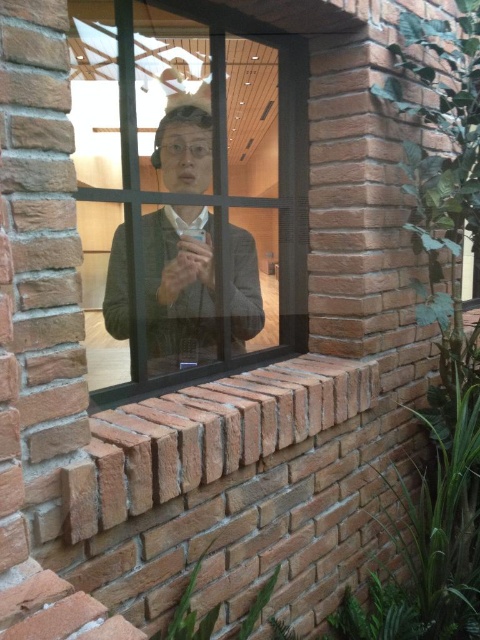
You are standing outside the brick wall and want to see the person inside holding the phone. Which direction should you look relative to the point marked at coordinates [190,188]?

You should look towards the center from the point marked at coordinates [190,188] because the clear glass window at center is located there, allowing you to see the person inside holding the phone.

You are an interior designer assessing the space through the clear glass window at center. You notice the matte gray jacket at center is placed near the window. Considering the size difference between the two, which object would allow more natural light into the room?

The clear glass window at center has a larger size compared to the matte gray jacket at center, so the window would allow more natural light into the room since it is bigger and made of transparent material.

You are a delivery person trying to hand over a package to the person at the window. The clear glass window at center and the matte gray jacket at center are in your line of sight. Which object should you approach first to ensure the person notices you?

The matte gray jacket at center is on the left side of the clear glass window at center. Since the person is looking out the window, approaching the matte gray jacket at center first would place you in their direct line of sight through the window, making it easier for them to notice you.